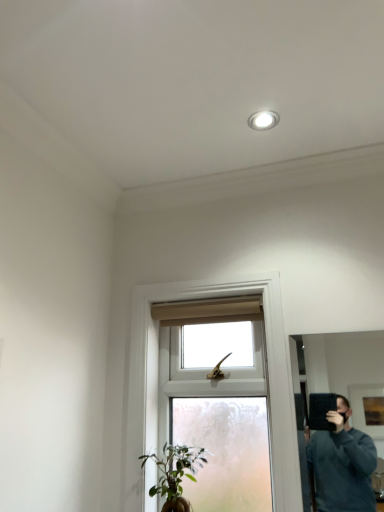
Locate an element on the screen. The image size is (384, 512). clear glass window at center is located at coordinates (157, 378).

What do you see at coordinates (340, 365) in the screenshot? I see `black matte mirror at right` at bounding box center [340, 365].

You are a GUI agent. You are given a task and a screenshot of the screen. Output one action in this format:
    pyautogui.click(x=<x>, y=<y>)
    Task: Click on the white glossy recessed light at upper center
    The width and height of the screenshot is (384, 512).
    Given the screenshot: What is the action you would take?
    pyautogui.click(x=263, y=120)

Considering the positions of objects green matte plant at lower center and clear glass window at center in the image provided, who is more to the left, green matte plant at lower center or clear glass window at center?

green matte plant at lower center is more to the left.

Is green matte plant at lower center shorter than clear glass window at center?

Yes.

Is green matte plant at lower center thinner than clear glass window at center?

Correct, the width of green matte plant at lower center is less than that of clear glass window at center.

Relative to clear glass window at center, is green matte plant at lower center in front or behind?

Visually, green matte plant at lower center is located behind clear glass window at center.

Consider the image. Is clear glass window at center situated inside green matte plant at lower center or outside?

The correct answer is: outside.

Does point (131, 416) come closer to viewer compared to point (152, 455)?

That is False.

You are a GUI agent. You are given a task and a screenshot of the screen. Output one action in this format:
    pyautogui.click(x=<x>, y=<y>)
    Task: Click on the houseplant behind the clear glass window at center
    This screenshot has width=384, height=512.
    Given the screenshot: What is the action you would take?
    pyautogui.click(x=175, y=474)

Considering the relative sizes of clear glass window at center and green matte plant at lower center in the image provided, is clear glass window at center thinner than green matte plant at lower center?

Incorrect, the width of clear glass window at center is not less than that of green matte plant at lower center.

Is black matte mirror at right to the left or to the right of clear glass window at center in the image?

Clearly, black matte mirror at right is on the right of clear glass window at center in the image.

Is there a large distance between black matte mirror at right and clear glass window at center?

Yes, black matte mirror at right is far from clear glass window at center.

Does black matte mirror at right lie behind clear glass window at center?

No, it is not.

Is point (196, 480) closer or farther from the camera than point (352, 343)?

Point (196, 480).

You are a GUI agent. You are given a task and a screenshot of the screen. Output one action in this format:
    pyautogui.click(x=<x>, y=<y>)
    Task: Click on the houseplant on the left side of black matte mirror at right
    
    Given the screenshot: What is the action you would take?
    pyautogui.click(x=175, y=474)

From a real-world perspective, who is located higher, green matte plant at lower center or black matte mirror at right?

From a 3D spatial view, black matte mirror at right is above.

Consider the image. Considering the sizes of objects green matte plant at lower center and black matte mirror at right in the image provided, who is smaller, green matte plant at lower center or black matte mirror at right?

With smaller size is black matte mirror at right.

From the image's perspective, would you say clear glass window at center is positioned over white glossy recessed light at upper center?

Incorrect, from the image's perspective, clear glass window at center is lower than white glossy recessed light at upper center.

Between clear glass window at center and white glossy recessed light at upper center, which one has smaller width?

white glossy recessed light at upper center.

Which object is more forward, clear glass window at center or white glossy recessed light at upper center?

Positioned in front is clear glass window at center.

Measure the distance from clear glass window at center to white glossy recessed light at upper center.

clear glass window at center and white glossy recessed light at upper center are 37.50 inches apart from each other.

Is the depth of white glossy recessed light at upper center less than that of clear glass window at center?

No, the depth of white glossy recessed light at upper center is greater than that of clear glass window at center.

From the image's perspective, between white glossy recessed light at upper center and clear glass window at center, who is located below?

clear glass window at center, from the image's perspective.

Is white glossy recessed light at upper center spatially inside clear glass window at center, or outside of it?

white glossy recessed light at upper center is not inside clear glass window at center, it's outside.

Based on their positions, is white glossy recessed light at upper center located to the left or right of clear glass window at center?

From the image, it's evident that white glossy recessed light at upper center is to the right of clear glass window at center.

Which of these two, green matte plant at lower center or white glossy recessed light at upper center, is thinner?

With smaller width is white glossy recessed light at upper center.

Which is behind, point (189, 449) or point (255, 124)?

The point (189, 449) is farther from the camera.

Is green matte plant at lower center spatially inside white glossy recessed light at upper center, or outside of it?

green matte plant at lower center is not enclosed by white glossy recessed light at upper center.

The width and height of the screenshot is (384, 512). In the image, there is a clear glass window at center. Find the location of `houseplant below it (from the image's perspective)`. houseplant below it (from the image's perspective) is located at coordinates (175, 474).

The image size is (384, 512). What are the coordinates of `window in front of the green matte plant at lower center` in the screenshot? It's located at (157, 378).

From the image, which object appears to be nearer to green matte plant at lower center, white glossy recessed light at upper center or black matte mirror at right?

white glossy recessed light at upper center.

Which object lies further to the anchor point green matte plant at lower center, black matte mirror at right or white glossy recessed light at upper center?

black matte mirror at right lies further to green matte plant at lower center than the other object.

Looking at the image, which one is located further to black matte mirror at right, green matte plant at lower center or clear glass window at center?

Based on the image, green matte plant at lower center appears to be further to black matte mirror at right.

Which object lies nearer to the anchor point green matte plant at lower center, black matte mirror at right or clear glass window at center?

The object closer to green matte plant at lower center is clear glass window at center.

Looking at the image, which one is located closer to white glossy recessed light at upper center, black matte mirror at right or green matte plant at lower center?

Based on the image, green matte plant at lower center appears to be nearer to white glossy recessed light at upper center.

Which object lies further to the anchor point white glossy recessed light at upper center, green matte plant at lower center or clear glass window at center?

green matte plant at lower center is further to white glossy recessed light at upper center.

In the scene shown: Estimate the real-world distances between objects in this image. Which object is closer to clear glass window at center, green matte plant at lower center or black matte mirror at right?

The object closer to clear glass window at center is green matte plant at lower center.

Looking at the image, which one is located further to clear glass window at center, black matte mirror at right or green matte plant at lower center?

The object further to clear glass window at center is black matte mirror at right.

Locate an element on the screen. window between white glossy recessed light at upper center and green matte plant at lower center vertically is located at coordinates (157, 378).

I want to click on mirror between white glossy recessed light at upper center and green matte plant at lower center in the up-down direction, so click(340, 365).

Find the location of `window between white glossy recessed light at upper center and black matte mirror at right in the up-down direction`. window between white glossy recessed light at upper center and black matte mirror at right in the up-down direction is located at coordinates (157, 378).

At what (x,y) coordinates should I click in order to perform the action: click on window between green matte plant at lower center and black matte mirror at right. Please return your answer as a coordinate pair (x, y). Looking at the image, I should click on (157, 378).